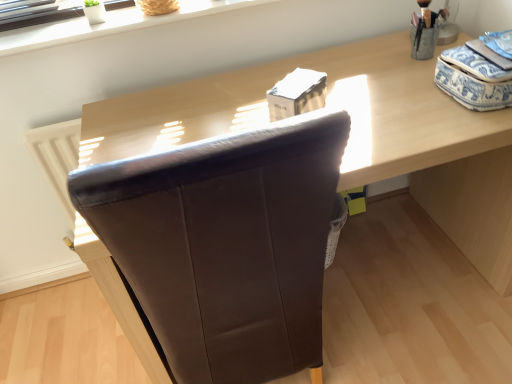
Question: Is brown leather chair at center taller than brown leather chair at center?

Choices:
 (A) yes
 (B) no

Answer: (B)

Question: Is brown leather chair at center positioned beyond the bounds of brown leather chair at center?

Choices:
 (A) no
 (B) yes

Answer: (B)

Question: Is brown leather chair at center next to brown leather chair at center?

Choices:
 (A) yes
 (B) no

Answer: (B)

Question: From a real-world perspective, is brown leather chair at center beneath brown leather chair at center?

Choices:
 (A) yes
 (B) no

Answer: (A)

Question: Considering the relative sizes of brown leather chair at center and brown leather chair at center in the image provided, is brown leather chair at center bigger than brown leather chair at center?

Choices:
 (A) no
 (B) yes

Answer: (B)

Question: Is white smooth window sill at upper center to the left or to the right of brown leather chair at center in the image?

Choices:
 (A) right
 (B) left

Answer: (B)

Question: Considering the positions of point coord(164,23) and point coord(287,263), is point coord(164,23) closer or farther from the camera than point coord(287,263)?

Choices:
 (A) farther
 (B) closer

Answer: (A)

Question: From a real-world perspective, relative to brown leather chair at center, is white smooth window sill at upper center vertically above or below?

Choices:
 (A) above
 (B) below

Answer: (A)

Question: Considering the positions of white smooth window sill at upper center and brown leather chair at center in the image, is white smooth window sill at upper center bigger or smaller than brown leather chair at center?

Choices:
 (A) big
 (B) small

Answer: (B)

Question: Is brown leather chair at center bigger or smaller than brown leather chair at center?

Choices:
 (A) big
 (B) small

Answer: (A)

Question: Is brown leather chair at center in front of or behind brown leather chair at center in the image?

Choices:
 (A) front
 (B) behind

Answer: (B)

Question: From the image's perspective, is brown leather chair at center positioned above or below brown leather chair at center?

Choices:
 (A) below
 (B) above

Answer: (B)

Question: Which is correct: brown leather chair at center is inside brown leather chair at center, or outside of it?

Choices:
 (A) inside
 (B) outside

Answer: (B)

Question: Choose the correct answer: Is white smooth window sill at upper center inside brown leather chair at center or outside it?

Choices:
 (A) outside
 (B) inside

Answer: (A)

Question: Is white smooth window sill at upper center bigger or smaller than brown leather chair at center?

Choices:
 (A) small
 (B) big

Answer: (A)